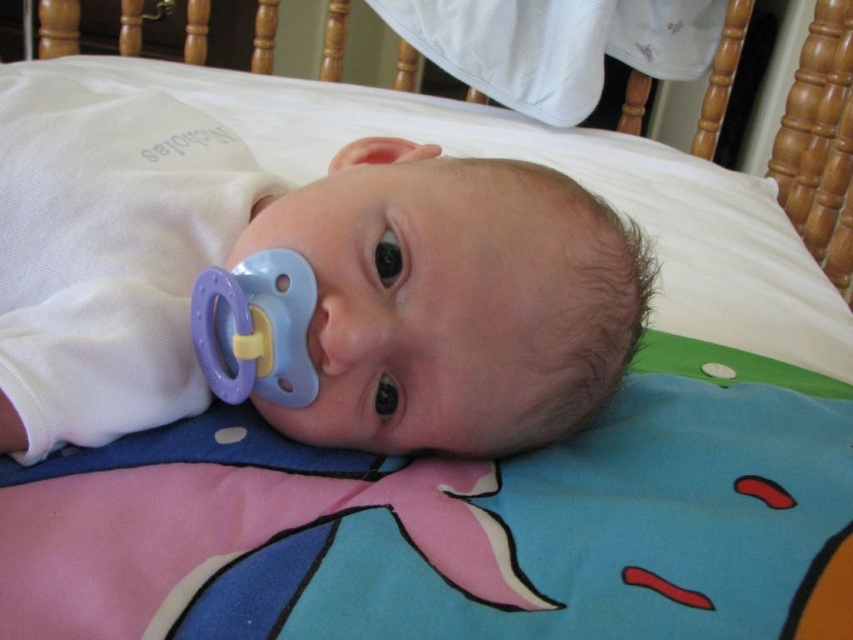
What are the coordinates of `white soft baby at center` in the screenshot? It's located at (316, 276).

This screenshot has width=853, height=640. Describe the element at coordinates (316, 276) in the screenshot. I see `white soft baby at center` at that location.

Where is `white soft baby at center`? Image resolution: width=853 pixels, height=640 pixels. white soft baby at center is located at coordinates (316, 276).